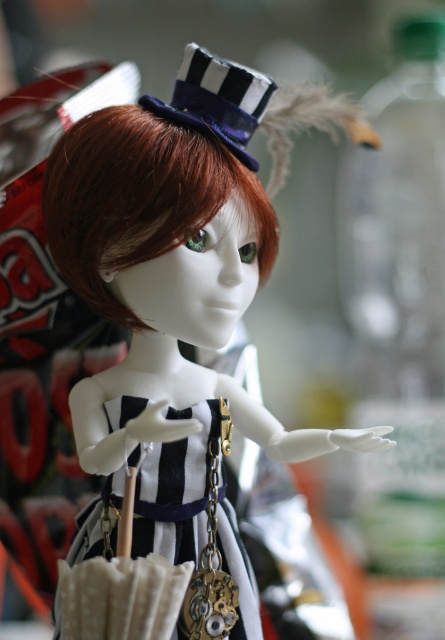
Question: Which point is closer to the camera taking this photo?

Choices:
 (A) (211, 77)
 (B) (238, 173)
 (C) (267, 106)

Answer: (B)

Question: Is matte black dress at center bigger than matte black and white dress hat at upper center?

Choices:
 (A) yes
 (B) no

Answer: (A)

Question: Can you confirm if black striped fabric dress at center is thinner than matte black and white dress hat at upper center?

Choices:
 (A) yes
 (B) no

Answer: (B)

Question: Which point is farther to the camera?

Choices:
 (A) (72, 588)
 (B) (84, 211)
 (C) (88, 621)
 (D) (197, 99)

Answer: (D)

Question: Is black striped fabric dress at center wider than matte black and white dress hat at upper center?

Choices:
 (A) yes
 (B) no

Answer: (A)

Question: Among these points, which one is farthest from the camera?

Choices:
 (A) (60, 592)
 (B) (222, 269)
 (C) (72, 154)
 (D) (229, 134)

Answer: (D)